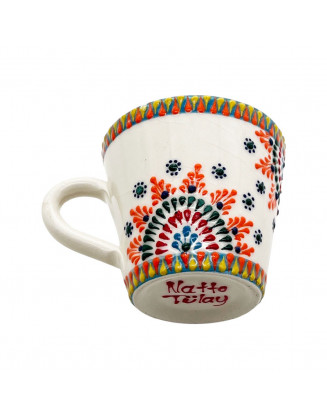
The image size is (327, 420). I want to click on orange paisley design, so click(261, 136), click(263, 165), click(272, 204), click(247, 248), click(243, 227), click(228, 192), click(196, 176), click(154, 185), click(135, 211), click(129, 249).